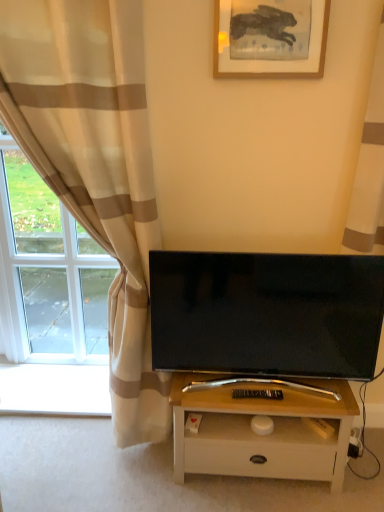
Question: From a real-world perspective, is beige striped curtain at left, acting as the 2th curtain starting from the right, physically above black plastic remote control at center?

Choices:
 (A) yes
 (B) no

Answer: (A)

Question: Considering the relative sizes of beige striped curtain at left, which is counted as the first curtain, starting from the left, and black plastic remote control at center in the image provided, is beige striped curtain at left, which is counted as the first curtain, starting from the left, smaller than black plastic remote control at center?

Choices:
 (A) yes
 (B) no

Answer: (B)

Question: Can you confirm if beige striped curtain at left, acting as the 2th curtain starting from the right, is shorter than black plastic remote control at center?

Choices:
 (A) no
 (B) yes

Answer: (A)

Question: From a real-world perspective, is beige striped curtain at left, which is counted as the first curtain, starting from the left, beneath black plastic remote control at center?

Choices:
 (A) no
 (B) yes

Answer: (A)

Question: Is the position of beige striped curtain at left, which is counted as the first curtain, starting from the left, more distant than that of black plastic remote control at center?

Choices:
 (A) no
 (B) yes

Answer: (A)

Question: Is point (139, 203) closer or farther from the camera than point (347, 250)?

Choices:
 (A) closer
 (B) farther

Answer: (A)

Question: In the image, is beige striped curtain at left, acting as the 2th curtain starting from the right, positioned in front of or behind beige striped curtain at upper right, which is the 2th curtain from left to right?

Choices:
 (A) front
 (B) behind

Answer: (A)

Question: Based on their sizes in the image, would you say beige striped curtain at left, which is counted as the first curtain, starting from the left, is bigger or smaller than beige striped curtain at upper right, which is the 2th curtain from left to right?

Choices:
 (A) small
 (B) big

Answer: (B)

Question: From a real-world perspective, is beige striped curtain at left, acting as the 2th curtain starting from the right, positioned above or below beige striped curtain at upper right, which is the 2th curtain from left to right?

Choices:
 (A) below
 (B) above

Answer: (A)

Question: Would you say beige striped curtain at upper right, which is the 2th curtain from left to right, is inside or outside wooden picture frame at upper center?

Choices:
 (A) inside
 (B) outside

Answer: (B)

Question: Looking at the image, does beige striped curtain at upper right, which is the 2th curtain from left to right, seem bigger or smaller compared to wooden picture frame at upper center?

Choices:
 (A) small
 (B) big

Answer: (B)

Question: In terms of width, does beige striped curtain at upper right, which is the 2th curtain from left to right, look wider or thinner when compared to wooden picture frame at upper center?

Choices:
 (A) wide
 (B) thin

Answer: (A)

Question: From the image's perspective, is beige striped curtain at upper right, which is the 2th curtain from left to right, located above or below wooden picture frame at upper center?

Choices:
 (A) above
 (B) below

Answer: (B)

Question: From a real-world perspective, is beige striped curtain at left, acting as the 2th curtain starting from the right, physically located above or below black plastic remote control at center?

Choices:
 (A) above
 (B) below

Answer: (A)

Question: In terms of height, does beige striped curtain at left, which is counted as the first curtain, starting from the left, look taller or shorter compared to black plastic remote control at center?

Choices:
 (A) tall
 (B) short

Answer: (A)